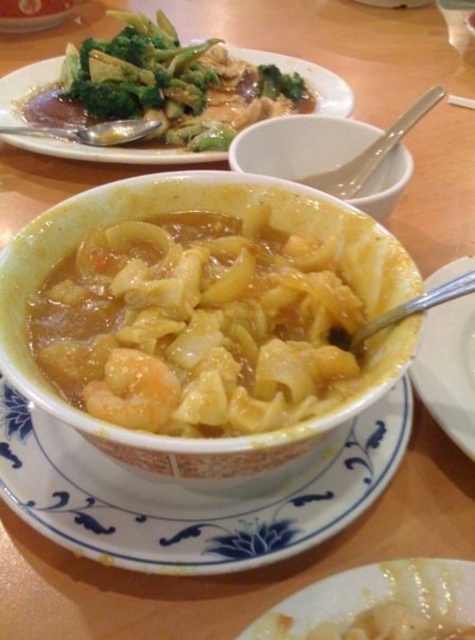
Between green leafy vegetables at upper left and white ceramic bowl at center, which one appears on the right side from the viewer's perspective?

white ceramic bowl at center

Is green leafy vegetables at upper left bigger than white ceramic bowl at center?

Yes.

You are a GUI agent. You are given a task and a screenshot of the screen. Output one action in this format:
    pyautogui.click(x=<x>, y=<y>)
    Task: Click on the green leafy vegetables at upper left
    This screenshot has height=640, width=475.
    Given the screenshot: What is the action you would take?
    pyautogui.click(x=112, y=152)

Who is higher up, white matte bowl at center or white ceramic bowl at center?

Positioned higher is white matte bowl at center.

Where is `white matte bowl at center`? The image size is (475, 640). white matte bowl at center is located at coordinates (298, 145).

Between white matte bowl at center and green leafy vegetables at upper left, which one appears on the left side from the viewer's perspective?

green leafy vegetables at upper left is more to the left.

Is point (372, 202) behind point (18, 115)?

No, it is in front of (18, 115).

Where is `white matte bowl at center`? white matte bowl at center is located at coordinates (298, 145).